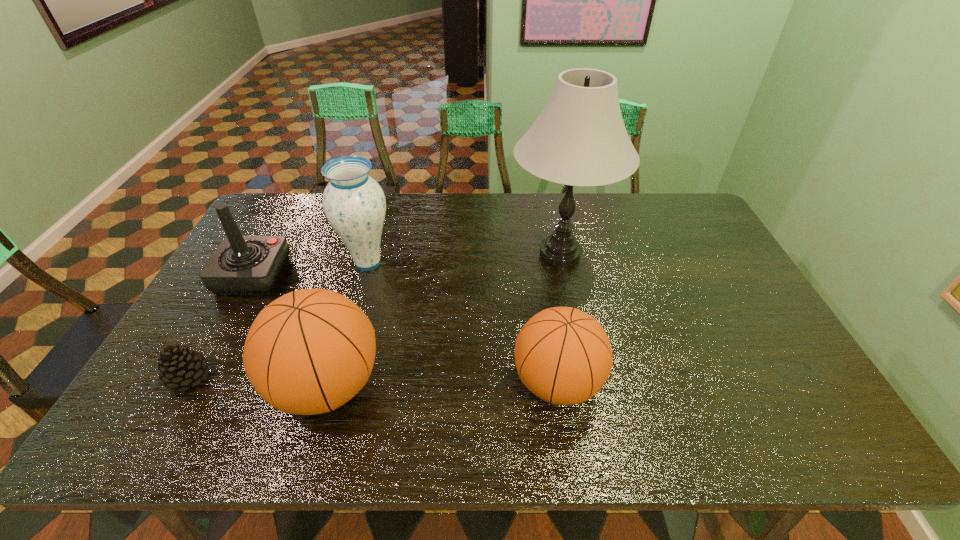
Where is `object that is the second closest one to the taller basketball`? Image resolution: width=960 pixels, height=540 pixels. object that is the second closest one to the taller basketball is located at coordinates (241, 265).

At what (x,y) coordinates should I click in order to perform the action: click on object that is the closest to the fifth shortest object. Please return your answer as a coordinate pair (x, y). The height and width of the screenshot is (540, 960). Looking at the image, I should click on (241, 265).

Locate an element on the screen. blank space that satisfies the following two spatial constraints: 1. on the front-facing side of the joystick; 2. on the right side of the taller basketball is located at coordinates (193, 386).

This screenshot has width=960, height=540. Identify the location of free space that satisfies the following two spatial constraints: 1. at the narrow end of the pinecone; 2. on the left side of the right basketball. (185, 383).

Where is `vacant area in the image that satisfies the following two spatial constraints: 1. on the front side of the tallest object; 2. on the front-facing side of the joystick`? vacant area in the image that satisfies the following two spatial constraints: 1. on the front side of the tallest object; 2. on the front-facing side of the joystick is located at coordinates (564, 276).

The image size is (960, 540). Find the location of `vacant space that satisfies the following two spatial constraints: 1. at the narrow end of the left basketball; 2. on the left side of the pinecone`. vacant space that satisfies the following two spatial constraints: 1. at the narrow end of the left basketball; 2. on the left side of the pinecone is located at coordinates (183, 386).